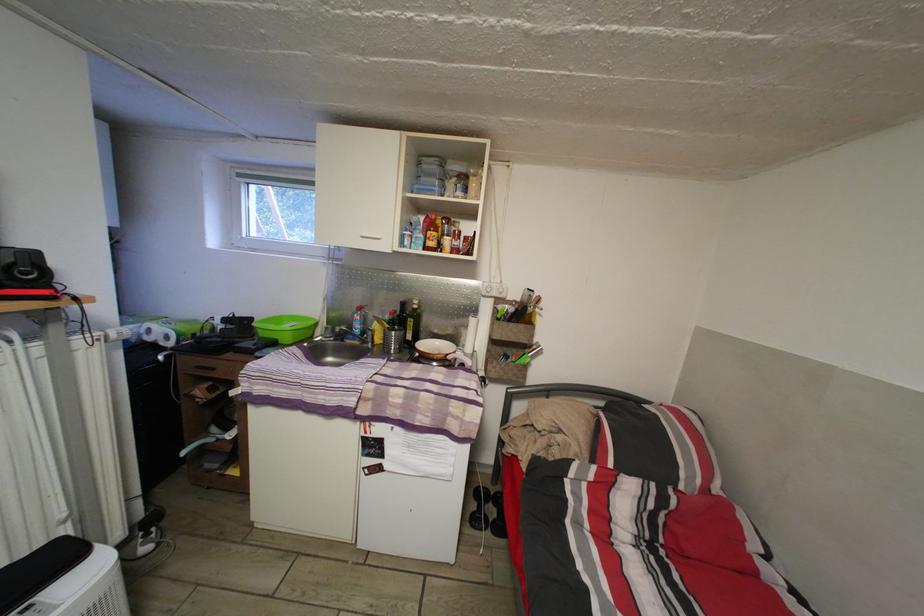
In order to click on black clothes iron in this screenshot , I will do `click(40, 570)`.